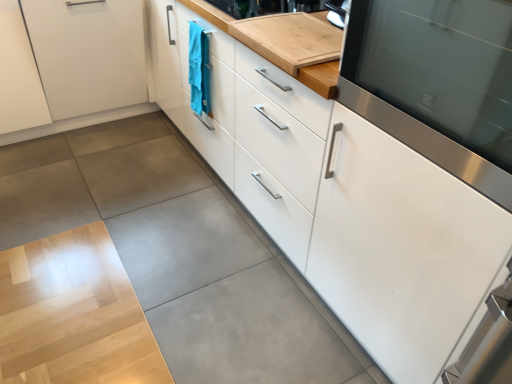
What are the coordinates of `white matte cabinet at lower left, positioned as the 3th cabinetry in right-to-left order` in the screenshot? It's located at (69, 59).

Where is `white glossy cabinet at right, which is the 1th cabinetry from right to left`? The image size is (512, 384). white glossy cabinet at right, which is the 1th cabinetry from right to left is located at coordinates (401, 249).

What do you see at coordinates (199, 70) in the screenshot? This screenshot has height=384, width=512. I see `teal fabric towel at center` at bounding box center [199, 70].

Locate an element on the screen. This screenshot has width=512, height=384. white matte cabinet at lower left, which appears as the 1th cabinetry when viewed from the left is located at coordinates click(69, 59).

Between white glossy cabinet at center, acting as the 2th cabinetry starting from the left, and bamboo cutting board at upper center, which one has smaller width?

Thinner between the two is bamboo cutting board at upper center.

Is the depth of white glossy cabinet at center, acting as the 2th cabinetry starting from the left, greater than that of bamboo cutting board at upper center?

No, white glossy cabinet at center, acting as the 2th cabinetry starting from the left, is closer to the viewer.

Considering the relative sizes of white glossy cabinet at center, the second cabinetry positioned from the right, and bamboo cutting board at upper center in the image provided, is white glossy cabinet at center, the second cabinetry positioned from the right, smaller than bamboo cutting board at upper center?

Actually, white glossy cabinet at center, the second cabinetry positioned from the right, might be larger than bamboo cutting board at upper center.

Does white matte cabinet at lower left, positioned as the 3th cabinetry in right-to-left order, have a lesser width compared to bamboo cutting board at upper center?

No, white matte cabinet at lower left, positioned as the 3th cabinetry in right-to-left order, is not thinner than bamboo cutting board at upper center.

Does white matte cabinet at lower left, positioned as the 3th cabinetry in right-to-left order, have a greater height compared to bamboo cutting board at upper center?

Yes, white matte cabinet at lower left, positioned as the 3th cabinetry in right-to-left order, is taller than bamboo cutting board at upper center.

Is point (26, 124) farther from camera compared to point (234, 24)?

Yes.

Could you tell me if white matte cabinet at lower left, which appears as the 1th cabinetry when viewed from the left, is facing bamboo cutting board at upper center?

Yes, white matte cabinet at lower left, which appears as the 1th cabinetry when viewed from the left, is turned towards bamboo cutting board at upper center.

Considering the positions of objects teal fabric towel at center and white matte cabinet at lower left, which appears as the 1th cabinetry when viewed from the left, in the image provided, who is more to the left, teal fabric towel at center or white matte cabinet at lower left, which appears as the 1th cabinetry when viewed from the left,?

white matte cabinet at lower left, which appears as the 1th cabinetry when viewed from the left.

Considering the sizes of objects teal fabric towel at center and white matte cabinet at lower left, which appears as the 1th cabinetry when viewed from the left, in the image provided, who is bigger, teal fabric towel at center or white matte cabinet at lower left, which appears as the 1th cabinetry when viewed from the left,?

Bigger between the two is white matte cabinet at lower left, which appears as the 1th cabinetry when viewed from the left.

Is teal fabric towel at center located outside white matte cabinet at lower left, positioned as the 3th cabinetry in right-to-left order?

Indeed, teal fabric towel at center is completely outside white matte cabinet at lower left, positioned as the 3th cabinetry in right-to-left order.

Identify the location of cabinetry that is the 2nd object to the left of the teal fabric towel at center, starting at the anchor. (69, 59).

Between white glossy cabinet at right, which is the 1th cabinetry from right to left, and bamboo cutting board at upper center, which one has smaller size?

With smaller size is bamboo cutting board at upper center.

Is point (316, 272) closer or farther from the camera than point (329, 59)?

Point (316, 272) is farther from the camera than point (329, 59).

From their relative heights in the image, would you say white glossy cabinet at right, marked as the third cabinetry in a left-to-right arrangement, is taller or shorter than bamboo cutting board at upper center?

white glossy cabinet at right, marked as the third cabinetry in a left-to-right arrangement, is taller than bamboo cutting board at upper center.

From a real-world perspective, who is located lower, white glossy cabinet at right, which is the 1th cabinetry from right to left, or bamboo cutting board at upper center?

From a 3D spatial view, white glossy cabinet at right, which is the 1th cabinetry from right to left, is below.

Find the location of a particular element. This screenshot has width=512, height=384. laundry above the white glossy cabinet at right, which is the 1th cabinetry from right to left (from the image's perspective) is located at coordinates (199, 70).

Is teal fabric towel at center directly adjacent to white glossy cabinet at right, which is the 1th cabinetry from right to left?

No.

Does teal fabric towel at center appear on the left side of white glossy cabinet at right, which is the 1th cabinetry from right to left?

Indeed, teal fabric towel at center is positioned on the left side of white glossy cabinet at right, which is the 1th cabinetry from right to left.

Does teal fabric towel at center have a smaller size compared to white glossy cabinet at right, marked as the third cabinetry in a left-to-right arrangement?

Yes.

In the scene shown: Measure the distance from white glossy cabinet at right, which is the 1th cabinetry from right to left, to white glossy cabinet at center, the second cabinetry positioned from the right.

white glossy cabinet at right, which is the 1th cabinetry from right to left, is 4.50 inches away from white glossy cabinet at center, the second cabinetry positioned from the right.

From the image's perspective, does white glossy cabinet at right, marked as the third cabinetry in a left-to-right arrangement, appear lower than white glossy cabinet at center, acting as the 2th cabinetry starting from the left?

Yes, from the image's perspective, white glossy cabinet at right, marked as the third cabinetry in a left-to-right arrangement, is beneath white glossy cabinet at center, acting as the 2th cabinetry starting from the left.

Considering the relative positions of white glossy cabinet at right, marked as the third cabinetry in a left-to-right arrangement, and white glossy cabinet at center, the second cabinetry positioned from the right, in the image provided, is white glossy cabinet at right, marked as the third cabinetry in a left-to-right arrangement, to the right of white glossy cabinet at center, the second cabinetry positioned from the right, from the viewer's perspective?

Yes.

Considering the sizes of objects white glossy cabinet at right, marked as the third cabinetry in a left-to-right arrangement, and white glossy cabinet at center, the second cabinetry positioned from the right, in the image provided, who is bigger, white glossy cabinet at right, marked as the third cabinetry in a left-to-right arrangement, or white glossy cabinet at center, the second cabinetry positioned from the right,?

With larger size is white glossy cabinet at center, the second cabinetry positioned from the right.

In terms of width, does stainless steel oven at right look wider or thinner when compared to white glossy cabinet at center, the second cabinetry positioned from the right?

Clearly, stainless steel oven at right has less width compared to white glossy cabinet at center, the second cabinetry positioned from the right.

Which is behind, point (488, 11) or point (220, 150)?

The point (220, 150) is farther.

From a real-world perspective, does stainless steel oven at right sit lower than white glossy cabinet at center, acting as the 2th cabinetry starting from the left?

Actually, stainless steel oven at right is physically above white glossy cabinet at center, acting as the 2th cabinetry starting from the left, in the real world.

Where is `home appliance in front of the white glossy cabinet at center, acting as the 2th cabinetry starting from the left`? This screenshot has height=384, width=512. home appliance in front of the white glossy cabinet at center, acting as the 2th cabinetry starting from the left is located at coordinates (437, 82).

Identify the location of cabinetry that is the 1st one when counting forward from the bamboo cutting board at upper center. This screenshot has width=512, height=384. (366, 158).

Starting from the bamboo cutting board at upper center, which cabinetry is the 2nd one to the left? Please provide its 2D coordinates.

[(69, 59)]

Based on their spatial positions, is white glossy cabinet at center, acting as the 2th cabinetry starting from the left, or white matte cabinet at lower left, positioned as the 3th cabinetry in right-to-left order, closer to stainless steel oven at right?

Based on the image, white glossy cabinet at center, acting as the 2th cabinetry starting from the left, appears to be nearer to stainless steel oven at right.

From the image, which object appears to be nearer to white matte cabinet at lower left, positioned as the 3th cabinetry in right-to-left order, teal fabric towel at center or white glossy cabinet at right, which is the 1th cabinetry from right to left?

teal fabric towel at center is positioned closer to the anchor white matte cabinet at lower left, positioned as the 3th cabinetry in right-to-left order.

Estimate the real-world distances between objects in this image. Which object is closer to white matte cabinet at lower left, which appears as the 1th cabinetry when viewed from the left, stainless steel oven at right or teal fabric towel at center?

teal fabric towel at center.

Which object lies further to the anchor point white matte cabinet at lower left, positioned as the 3th cabinetry in right-to-left order, teal fabric towel at center or bamboo cutting board at upper center?

Among the two, bamboo cutting board at upper center is located further to white matte cabinet at lower left, positioned as the 3th cabinetry in right-to-left order.

Based on their spatial positions, is teal fabric towel at center or white glossy cabinet at center, acting as the 2th cabinetry starting from the left, further from white matte cabinet at lower left, positioned as the 3th cabinetry in right-to-left order?

The object further to white matte cabinet at lower left, positioned as the 3th cabinetry in right-to-left order, is white glossy cabinet at center, acting as the 2th cabinetry starting from the left.

Based on their spatial positions, is bamboo cutting board at upper center or white matte cabinet at lower left, positioned as the 3th cabinetry in right-to-left order, closer to white glossy cabinet at right, marked as the third cabinetry in a left-to-right arrangement?

bamboo cutting board at upper center.

Considering their positions, is white matte cabinet at lower left, which appears as the 1th cabinetry when viewed from the left, positioned closer to white glossy cabinet at center, the second cabinetry positioned from the right, than bamboo cutting board at upper center?

bamboo cutting board at upper center is positioned closer to the anchor white glossy cabinet at center, the second cabinetry positioned from the right.

When comparing their distances from white glossy cabinet at right, marked as the third cabinetry in a left-to-right arrangement, does teal fabric towel at center or white glossy cabinet at center, the second cabinetry positioned from the right, seem further?

The object further to white glossy cabinet at right, marked as the third cabinetry in a left-to-right arrangement, is teal fabric towel at center.

Identify the location of countertop located between white glossy cabinet at center, acting as the 2th cabinetry starting from the left, and stainless steel oven at right in the left-right direction. The height and width of the screenshot is (384, 512). (286, 42).

The image size is (512, 384). Find the location of `cabinetry between white matte cabinet at lower left, positioned as the 3th cabinetry in right-to-left order, and bamboo cutting board at upper center from left to right`. cabinetry between white matte cabinet at lower left, positioned as the 3th cabinetry in right-to-left order, and bamboo cutting board at upper center from left to right is located at coordinates (366, 158).

Locate an element on the screen. This screenshot has width=512, height=384. laundry between white glossy cabinet at center, acting as the 2th cabinetry starting from the left, and white matte cabinet at lower left, which appears as the 1th cabinetry when viewed from the left, along the z-axis is located at coordinates (199, 70).

Locate an element on the screen. The height and width of the screenshot is (384, 512). laundry located between white matte cabinet at lower left, which appears as the 1th cabinetry when viewed from the left, and bamboo cutting board at upper center in the left-right direction is located at coordinates (199, 70).